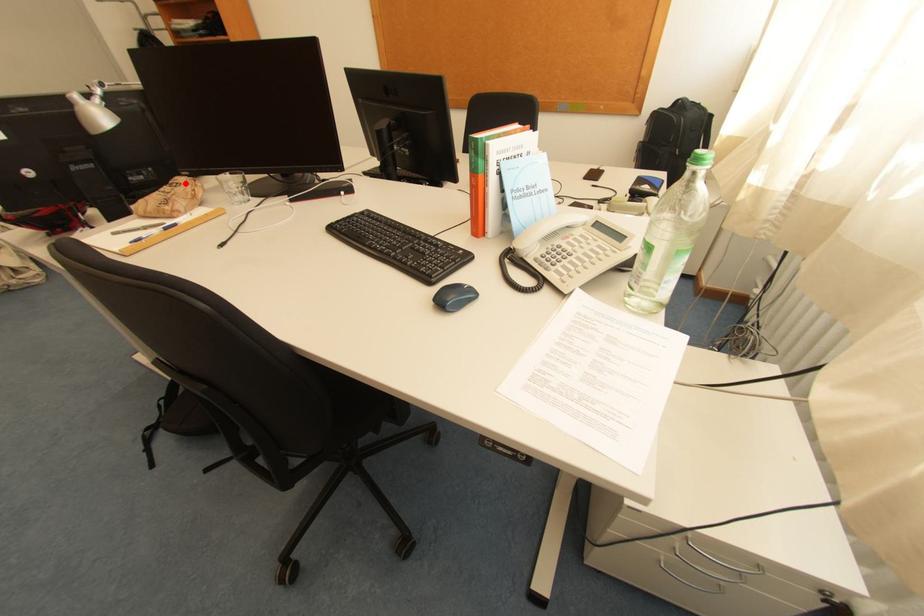
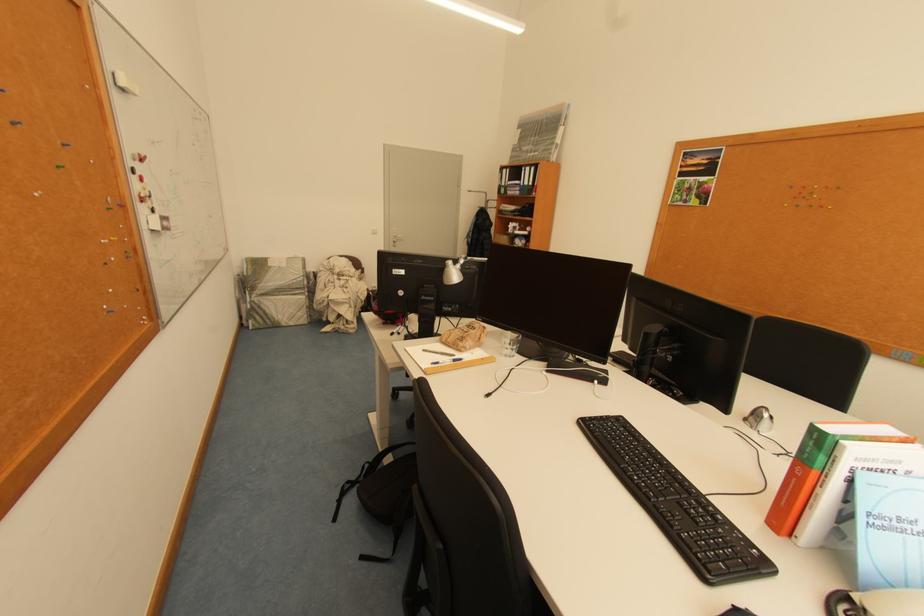
Where in the second image is the point corresponding to the highlighted location from the first image?

(481, 328)